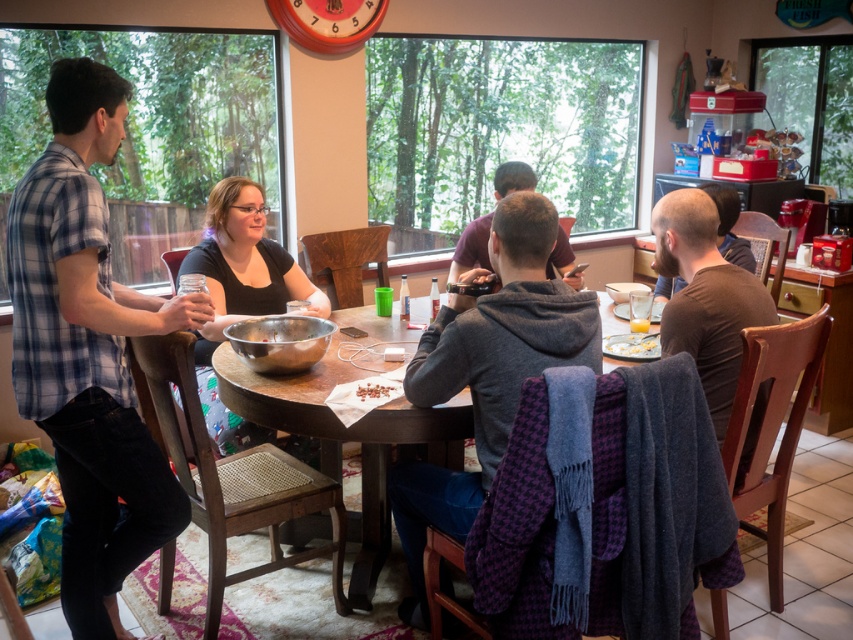
Question: Considering the real-world distances, which object is closest to the plaid cotton shirt at left?

Choices:
 (A) shiny chocolate bar at center
 (B) metallic bowl at center
 (C) matte brown shirt at center
 (D) brown matte shirt at right

Answer: (B)

Question: Which of the following is the closest to the observer?

Choices:
 (A) shiny chocolate bar at center
 (B) wooden table at center
 (C) brown matte shirt at right

Answer: (B)

Question: Can you confirm if matte brown shirt at center is thinner than yellow matte cereal bowl at center?

Choices:
 (A) no
 (B) yes

Answer: (A)

Question: Is wooden table at center to the right of yellow matte cereal bowl at center from the viewer's perspective?

Choices:
 (A) no
 (B) yes

Answer: (A)

Question: Among these objects, which one is farthest from the camera?

Choices:
 (A) yellow matte cereal bowl at center
 (B) plaid cotton shirt at left
 (C) brown matte shirt at right

Answer: (A)

Question: Where is plaid cotton shirt at left located in relation to wooden table at center in the image?

Choices:
 (A) above
 (B) below

Answer: (B)